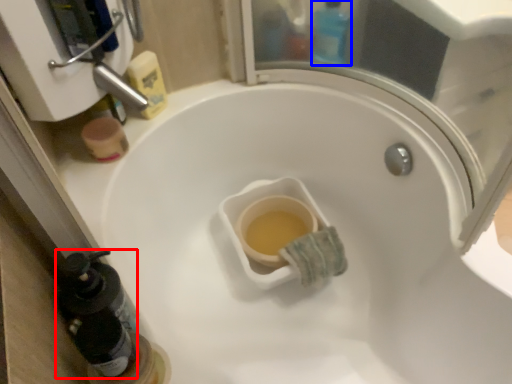
Question: Which point is further to the camera, bottle (highlighted by a red box) or bottle (highlighted by a blue box)?

Choices:
 (A) bottle
 (B) bottle

Answer: (B)